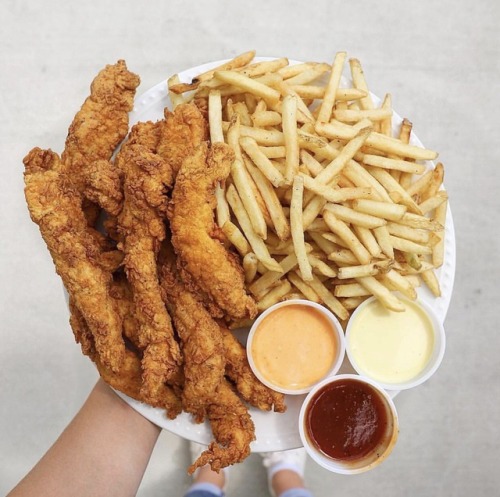
Where is `white translucent sauce cups`? white translucent sauce cups is located at coordinates (292, 392), (314, 457), (440, 346).